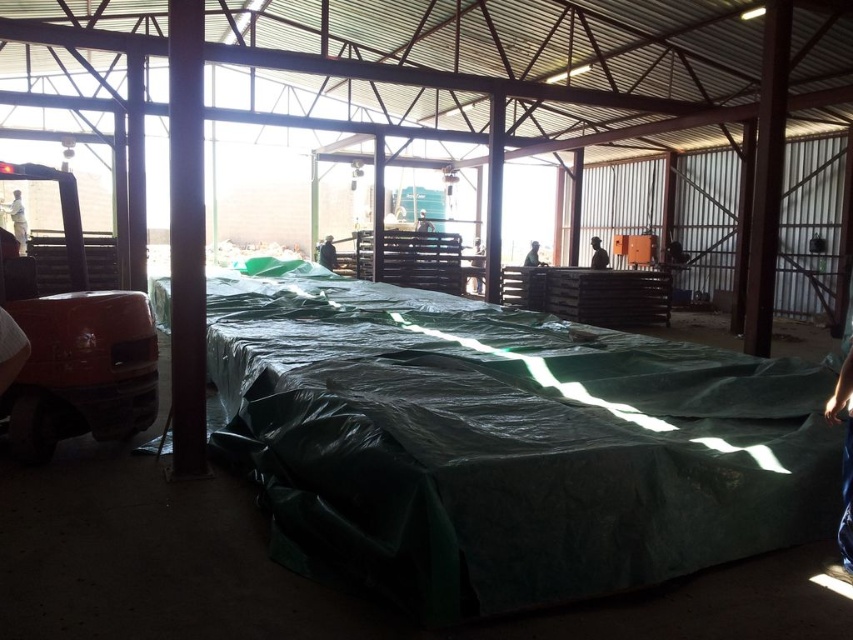
Between black fabric worker at center and green fabric worker at center, which one appears on the left side from the viewer's perspective?

green fabric worker at center is more to the left.

Find the location of a particular element. This screenshot has width=853, height=640. black fabric worker at center is located at coordinates (598, 253).

Can you confirm if white matte shirt at left is positioned below green fabric worker at center?

Indeed, white matte shirt at left is positioned under green fabric worker at center.

The height and width of the screenshot is (640, 853). What do you see at coordinates (16, 220) in the screenshot?
I see `white matte shirt at left` at bounding box center [16, 220].

Where is `white matte shirt at left`? white matte shirt at left is located at coordinates [16, 220].

Consider the image. Is green tarp at center further to the viewer compared to black fabric worker at center?

No, it is in front of black fabric worker at center.

Is green tarp at center taller than black fabric worker at center?

No, green tarp at center is not taller than black fabric worker at center.

Where is `green tarp at center`? green tarp at center is located at coordinates (508, 444).

At what (x,y) coordinates should I click in order to perform the action: click on green tarp at center. Please return your answer as a coordinate pair (x, y). Looking at the image, I should click on (508, 444).